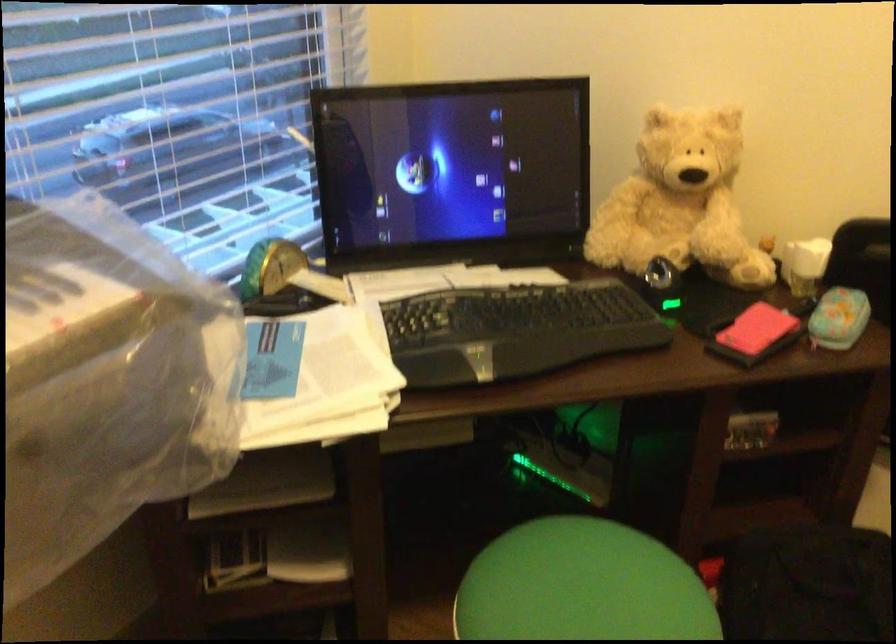
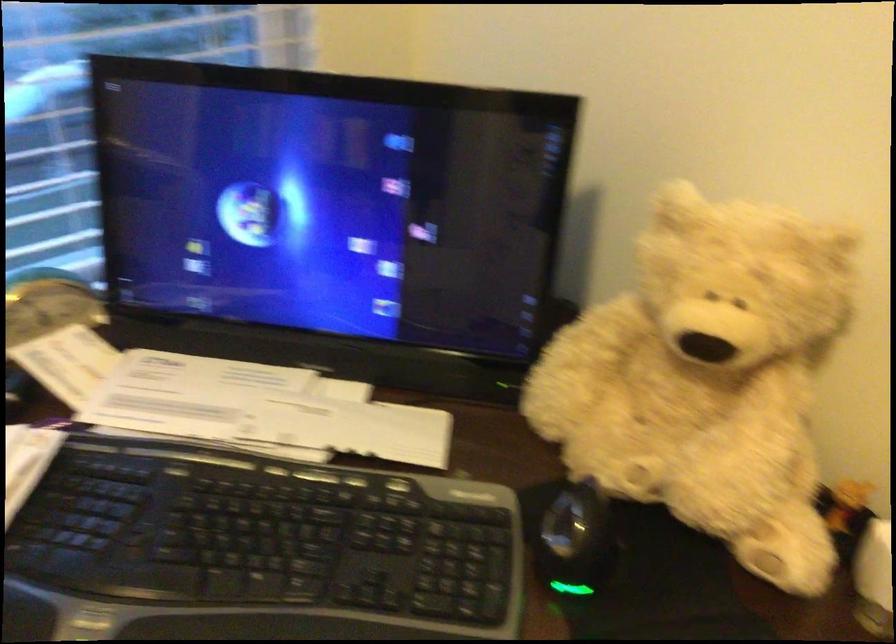
In a continuous first-person perspective shot, in which direction is the camera moving?

The movement direction of the cameraman is right, forward.